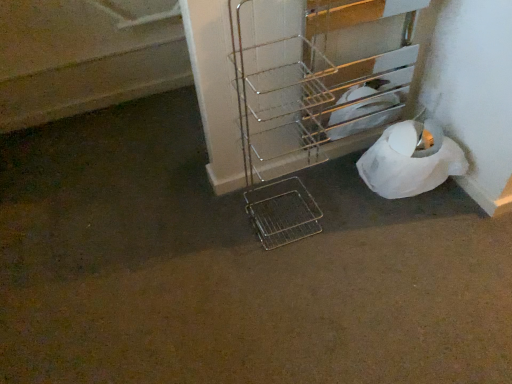
Question: Which direction should I rotate to look at metallic wire trolley at center, marked as the second trolley in a right-to-left arrangement?

Choices:
 (A) right
 (B) left

Answer: (A)

Question: From the image's perspective, does white paper at lower right appear lower than metallic wire trolley at lower right, acting as the first trolley starting from the right?

Choices:
 (A) no
 (B) yes

Answer: (B)

Question: Considering the relative sizes of white paper at lower right and metallic wire trolley at lower right, placed as the 2th trolley when sorted from left to right, in the image provided, is white paper at lower right wider than metallic wire trolley at lower right, placed as the 2th trolley when sorted from left to right,?

Choices:
 (A) no
 (B) yes

Answer: (B)

Question: Is the position of white paper at lower right less distant than that of metallic wire trolley at lower right, acting as the first trolley starting from the right?

Choices:
 (A) no
 (B) yes

Answer: (A)

Question: Is white paper at lower right located outside metallic wire trolley at lower right, acting as the first trolley starting from the right?

Choices:
 (A) yes
 (B) no

Answer: (A)

Question: From a real-world perspective, is white paper at lower right located beneath metallic wire trolley at lower right, placed as the 2th trolley when sorted from left to right?

Choices:
 (A) no
 (B) yes

Answer: (B)

Question: Is white paper at lower right touching metallic wire trolley at lower right, placed as the 2th trolley when sorted from left to right?

Choices:
 (A) yes
 (B) no

Answer: (B)

Question: Can metallic wire trolley at lower right, acting as the first trolley starting from the right, be found inside metallic wire trolley at center, marked as the second trolley in a right-to-left arrangement?

Choices:
 (A) no
 (B) yes

Answer: (A)

Question: Can you confirm if metallic wire trolley at center, marked as the second trolley in a right-to-left arrangement, is positioned to the left of metallic wire trolley at lower right, placed as the 2th trolley when sorted from left to right?

Choices:
 (A) yes
 (B) no

Answer: (A)

Question: Considering the relative sizes of metallic wire trolley at center, the first trolley in the left-to-right sequence, and metallic wire trolley at lower right, acting as the first trolley starting from the right, in the image provided, is metallic wire trolley at center, the first trolley in the left-to-right sequence, taller than metallic wire trolley at lower right, acting as the first trolley starting from the right,?

Choices:
 (A) no
 (B) yes

Answer: (B)

Question: From a real-world perspective, is metallic wire trolley at center, the first trolley in the left-to-right sequence, positioned over metallic wire trolley at lower right, placed as the 2th trolley when sorted from left to right, based on gravity?

Choices:
 (A) no
 (B) yes

Answer: (B)

Question: Is metallic wire trolley at center, the first trolley in the left-to-right sequence, next to metallic wire trolley at lower right, placed as the 2th trolley when sorted from left to right, and touching it?

Choices:
 (A) yes
 (B) no

Answer: (B)

Question: Is metallic wire trolley at center, the first trolley in the left-to-right sequence, far from metallic wire trolley at lower right, acting as the first trolley starting from the right?

Choices:
 (A) no
 (B) yes

Answer: (A)

Question: Is metallic wire trolley at lower right, acting as the first trolley starting from the right, not within white paper at lower right?

Choices:
 (A) yes
 (B) no

Answer: (A)